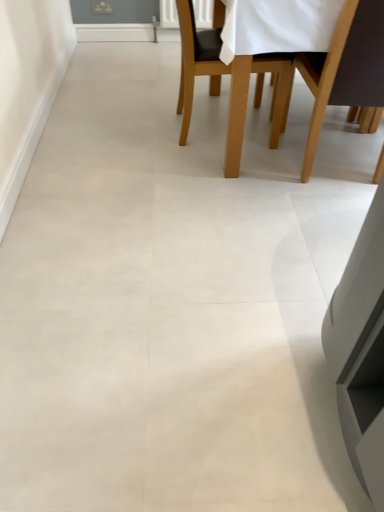
This screenshot has height=512, width=384. Identify the location of free area behind brown wood chair at upper right, acting as the second chair starting from the left. (319, 141).